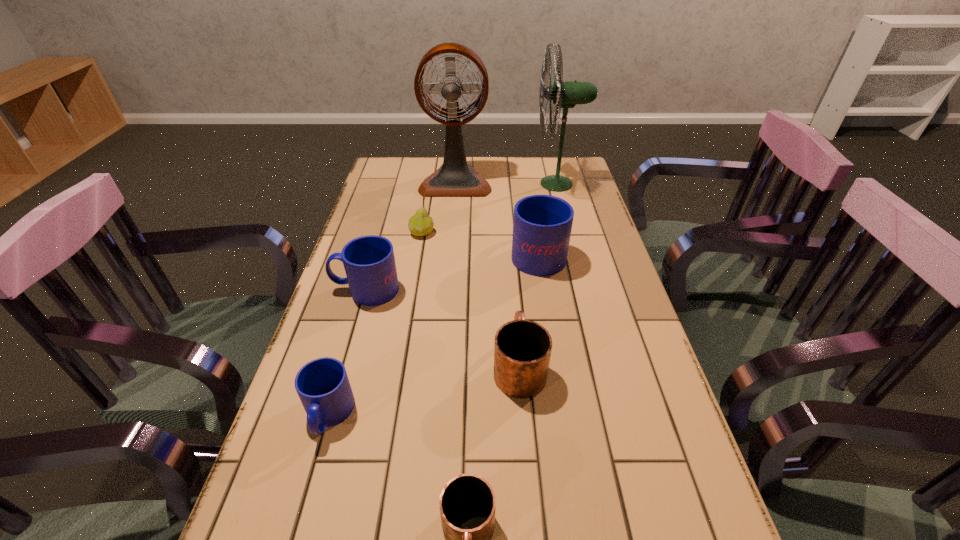
Identify the location of free spot between the pear and the smallest blue mug. This screenshot has height=540, width=960. (375, 324).

The width and height of the screenshot is (960, 540). Find the location of `free space between the nearest blue mug and the sixth shortest object`. free space between the nearest blue mug and the sixth shortest object is located at coordinates (433, 333).

At what (x,y) coordinates should I click in order to perform the action: click on unoccupied position between the biggest blue mug and the green pear. Please return your answer as a coordinate pair (x, y). The height and width of the screenshot is (540, 960). Looking at the image, I should click on (480, 242).

Identify the location of vacant area that lies between the nearest blue mug and the rightmost blue mug. The width and height of the screenshot is (960, 540). (433, 333).

Select which object appears as the fifth closest to the sixth shortest object. Please provide its 2D coordinates. Your answer should be formatted as a tuple, i.e. [(x, y)], where the tuple contains the x and y coordinates of a point satisfying the conditions above.

[(369, 262)]

What are the coordinates of `object that is the third closest to the farther rust mug` in the screenshot? It's located at (369, 262).

Point out which mug is positioned as the fifth nearest to the green fan. Please provide its 2D coordinates. Your answer should be formatted as a tuple, i.e. [(x, y)], where the tuple contains the x and y coordinates of a point satisfying the conditions above.

[(467, 505)]

Locate which mug ranks fourth in proximity to the second smallest blue mug. Please provide its 2D coordinates. Your answer should be formatted as a tuple, i.e. [(x, y)], where the tuple contains the x and y coordinates of a point satisfying the conditions above.

[(467, 505)]

Identify the location of blue mug identified as the closest to the pear. (369, 262).

Identify the location of the second closest blue mug relative to the second biggest blue mug. This screenshot has height=540, width=960. point(542,224).